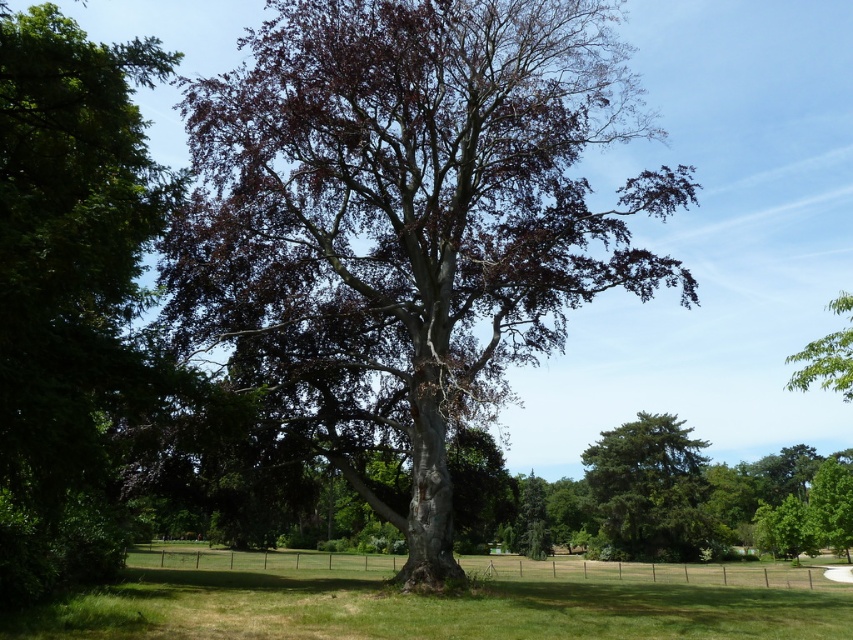
Consider the image. You are standing in the park and want to take a photo of both the dark brown bark tree at center and the green grass at lower center. Which object should you focus on first to ensure both are in the frame?

You should focus on the dark brown bark tree at center first because it is closer to you than the green grass at lower center, ensuring both are in the frame.

You are a bird looking for a nesting spot. You see the dark brown bark tree at center and the green textured pine tree at center. Which tree is taller and would provide a better vantage point?

The dark brown bark tree at center is taller than the green textured pine tree at center, so it would provide a better vantage point.

You are standing in the park and see the green grass at lower center and the green textured pine tree at center. Which object is positioned more to the left side?

The green grass at lower center is positioned to the left of the green textured pine tree at center, so it is more to the left side.